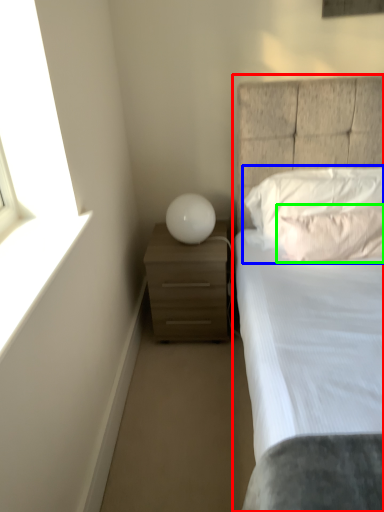
Question: Considering the real-world distances, which object is closest to bed (highlighted by a red box)? pillow (highlighted by a blue box) or pillow (highlighted by a green box).

Choices:
 (A) pillow
 (B) pillow

Answer: (A)